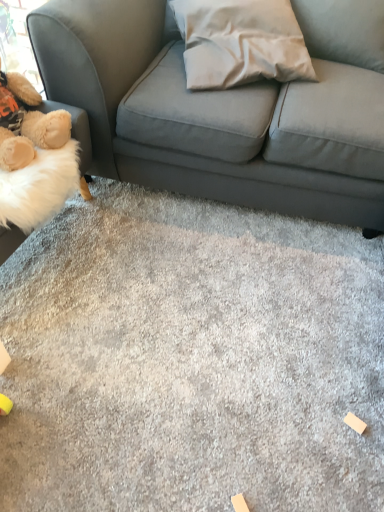
Question: Is fluffy beige teddy bear at left completely or partially inside white fabric pillow at center?

Choices:
 (A) yes
 (B) no

Answer: (B)

Question: Does white fabric pillow at center have a larger size compared to fluffy beige teddy bear at left?

Choices:
 (A) yes
 (B) no

Answer: (A)

Question: Does white fabric pillow at center lie in front of fluffy beige teddy bear at left?

Choices:
 (A) yes
 (B) no

Answer: (B)

Question: Is the surface of white fabric pillow at center in direct contact with fluffy beige teddy bear at left?

Choices:
 (A) yes
 (B) no

Answer: (B)

Question: Is white fabric pillow at center to the left of fluffy beige teddy bear at left from the viewer's perspective?

Choices:
 (A) yes
 (B) no

Answer: (B)

Question: Considering the positions of point (61, 144) and point (236, 79), is point (61, 144) closer or farther from the camera than point (236, 79)?

Choices:
 (A) farther
 (B) closer

Answer: (B)

Question: Relative to white fabric pillow at center, is fluffy beige teddy bear at left in front or behind?

Choices:
 (A) behind
 (B) front

Answer: (B)

Question: Considering the positions of fluffy beige teddy bear at left and white fabric pillow at center in the image, is fluffy beige teddy bear at left taller or shorter than white fabric pillow at center?

Choices:
 (A) tall
 (B) short

Answer: (A)

Question: From a real-world perspective, relative to white fabric pillow at center, is fluffy beige teddy bear at left vertically above or below?

Choices:
 (A) above
 (B) below

Answer: (B)

Question: Would you say gray carpet at center is inside or outside white fabric pillow at center?

Choices:
 (A) inside
 (B) outside

Answer: (B)

Question: Is gray carpet at center taller or shorter than white fabric pillow at center?

Choices:
 (A) short
 (B) tall

Answer: (A)

Question: From the image's perspective, is gray carpet at center positioned above or below white fabric pillow at center?

Choices:
 (A) below
 (B) above

Answer: (A)

Question: Considering the positions of gray carpet at center and white fabric pillow at center in the image, is gray carpet at center bigger or smaller than white fabric pillow at center?

Choices:
 (A) small
 (B) big

Answer: (B)

Question: Based on their positions, is white fabric pillow at center located to the left or right of gray carpet at center?

Choices:
 (A) right
 (B) left

Answer: (A)

Question: In terms of width, does white fabric pillow at center look wider or thinner when compared to gray carpet at center?

Choices:
 (A) thin
 (B) wide

Answer: (A)